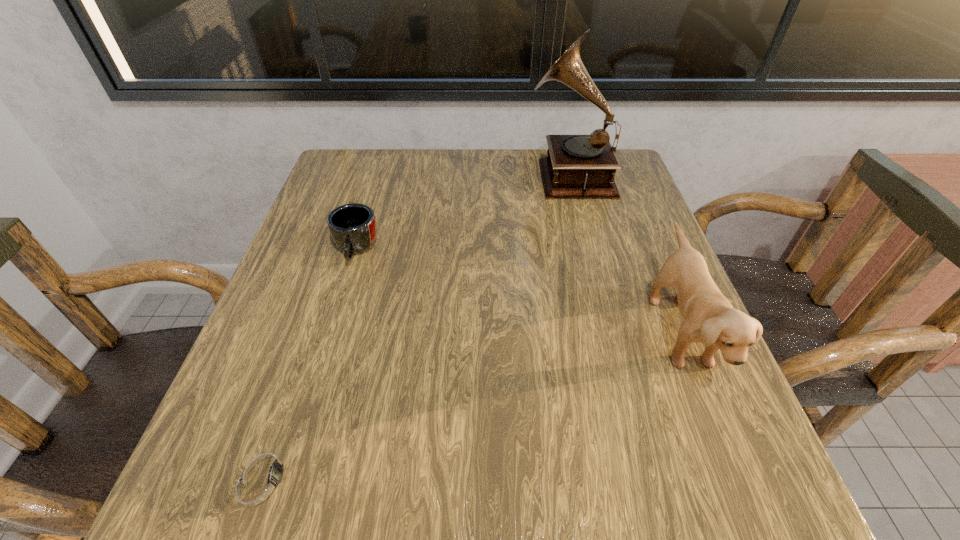
Find the location of a particular element. This screenshot has width=960, height=540. object at the near left corner is located at coordinates click(261, 480).

Identify the location of object located in the far right corner section of the desktop. (577, 166).

Where is `vacant space at the far edge`? Image resolution: width=960 pixels, height=540 pixels. vacant space at the far edge is located at coordinates (524, 178).

Image resolution: width=960 pixels, height=540 pixels. Find the location of `free space at the near edge`. free space at the near edge is located at coordinates (606, 481).

You are a GUI agent. You are given a task and a screenshot of the screen. Output one action in this format:
    pyautogui.click(x=<x>, y=<y>)
    Task: Click on the free space at the left edge of the desktop
    
    Given the screenshot: What is the action you would take?
    pyautogui.click(x=313, y=202)

In the image, there is a desktop. In order to click on free region at the right edge in this screenshot , I will do `click(646, 321)`.

Where is `vacant space at the far left corner of the desktop`? The image size is (960, 540). vacant space at the far left corner of the desktop is located at coordinates (316, 201).

Identify the location of vacant space at the near left corner of the desktop. Image resolution: width=960 pixels, height=540 pixels. (295, 509).

At what (x,y) coordinates should I click in order to perform the action: click on vacant space in between the nearest object and the puppy. Please return your answer as a coordinate pair (x, y). The height and width of the screenshot is (540, 960). Looking at the image, I should click on (471, 404).

Identify the location of free area in between the tallest object and the shortest object. (417, 326).